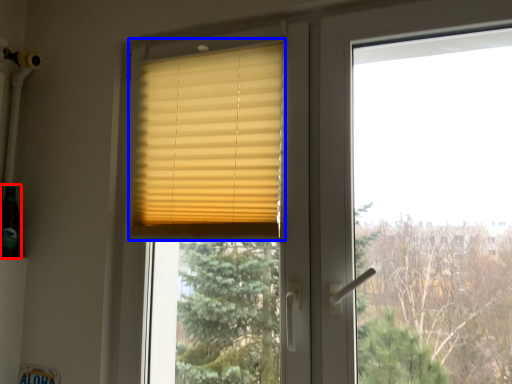
Question: Which object appears closest to the camera in this image, champagne (highlighted by a red box) or window blind (highlighted by a blue box)?

Choices:
 (A) champagne
 (B) window blind

Answer: (B)